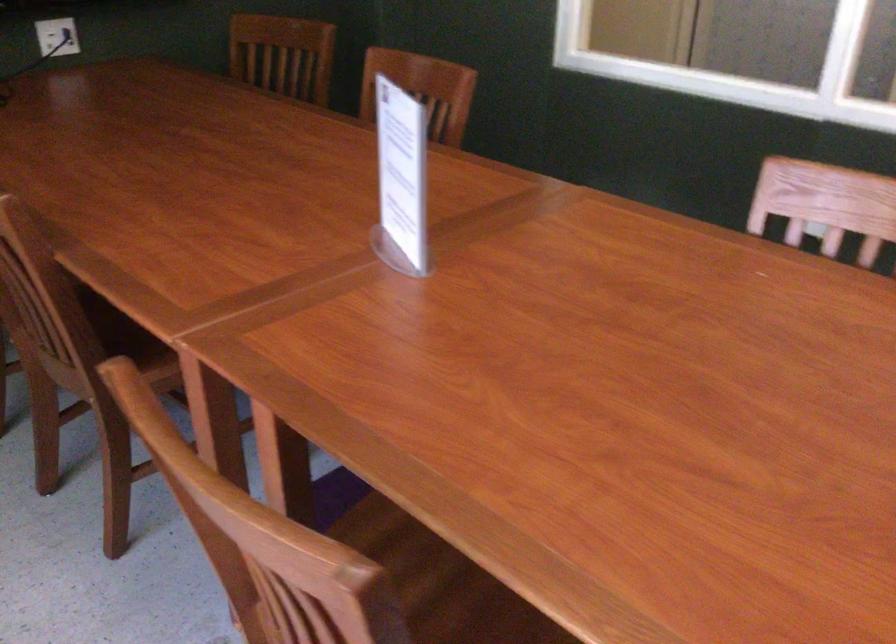
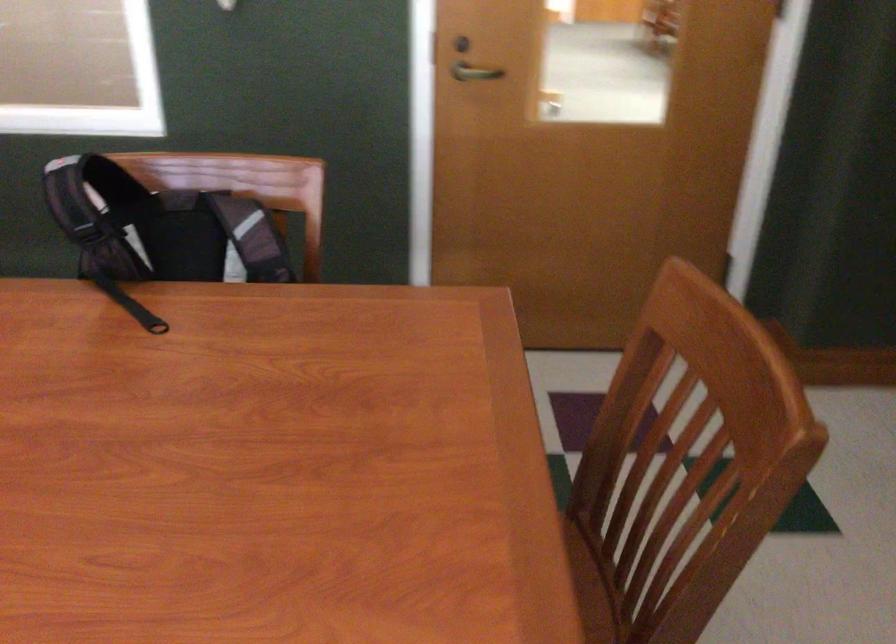
Question: The camera is either moving clockwise (left) or counter-clockwise (right) around the object. The first image is from the beginning of the video and the second image is from the end. Is the camera moving left or right when shooting the video?

Choices:
 (A) Left
 (B) Right

Answer: (A)